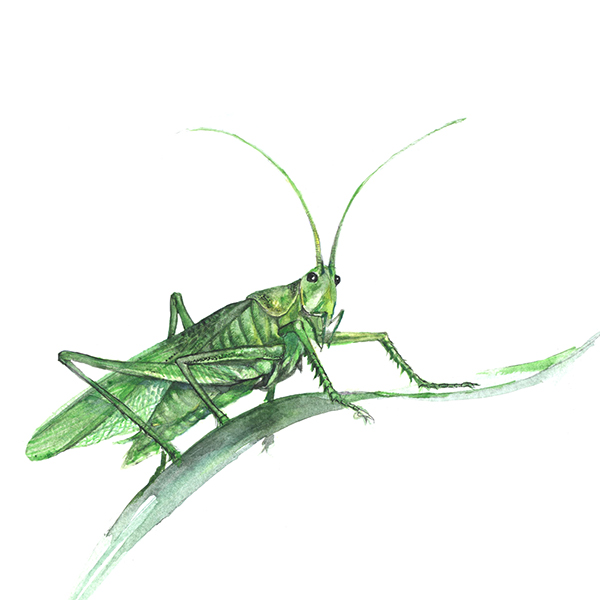
In order to click on artwork in this screenshot , I will do `click(298, 372)`.